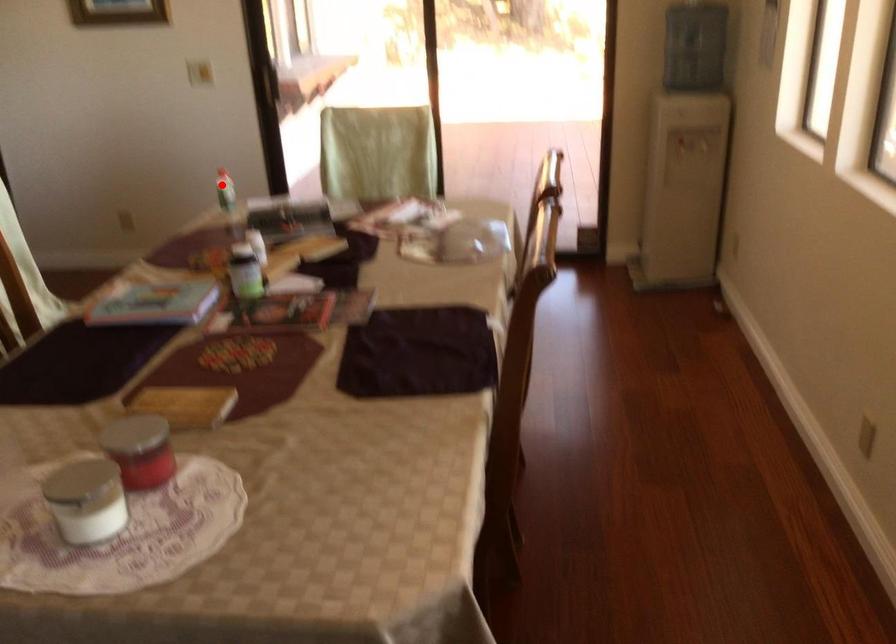
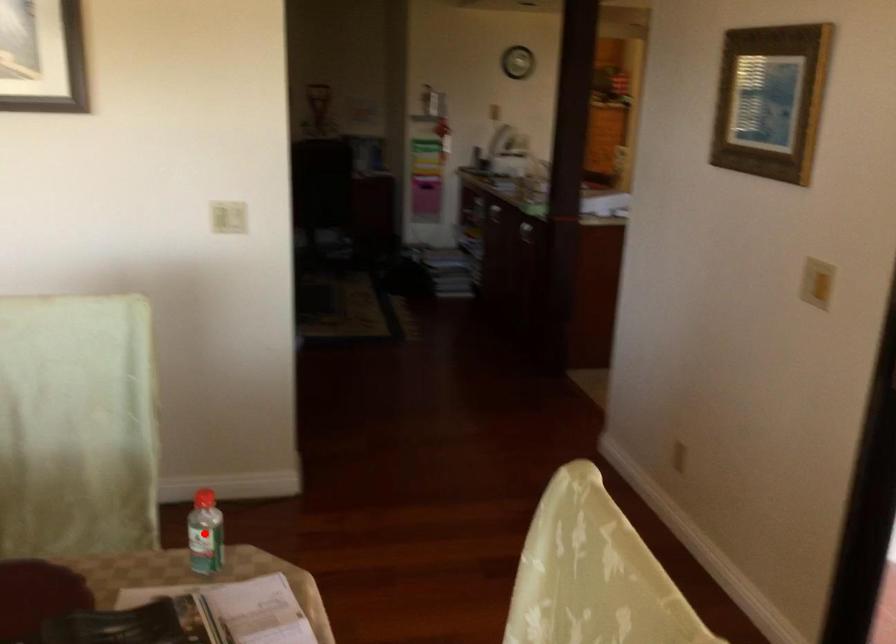
Consider the image. I am providing you with two images of the same scene from different viewpoints. A red point is marked on the first image and another point is marked on the second image. Is the red point in image1 aligned with the point shown in image2?

Yes